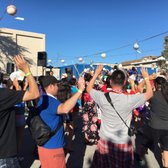
Identify the location of white wall. (35, 59), (2, 65).